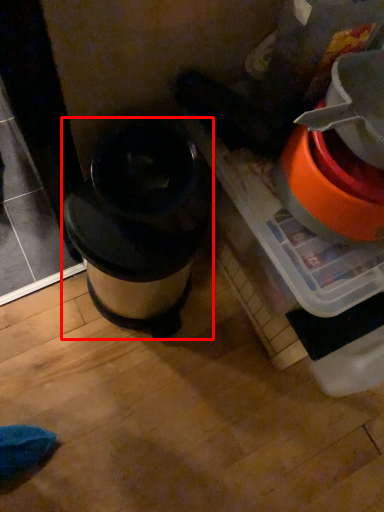
Question: From the image's perspective, where is waste container (annotated by the red box) located relative to appliance?

Choices:
 (A) above
 (B) below

Answer: (B)